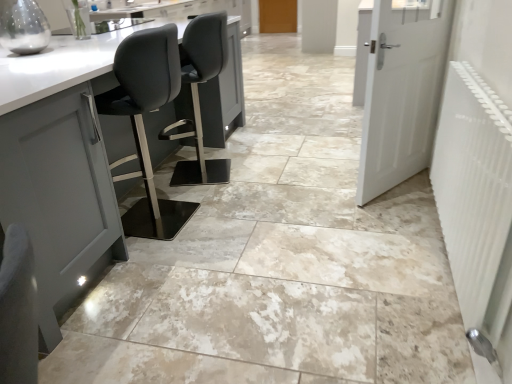
Find the location of a particular element. free region under white matte door at right, placed as the first door when sorted from front to back (from a real-world perspective) is located at coordinates (394, 187).